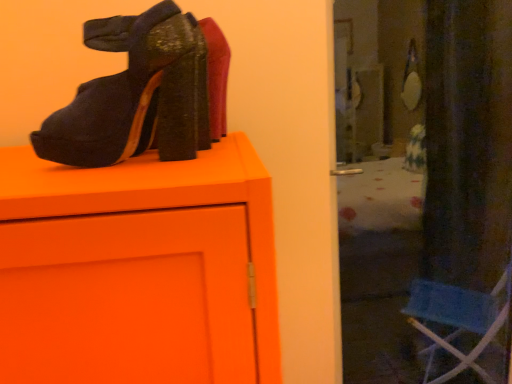
What are the coordinates of `shiny black leather high heels at upper left` in the screenshot? It's located at [133, 95].

This screenshot has width=512, height=384. Describe the element at coordinates (133, 95) in the screenshot. I see `shiny black leather high heels at upper left` at that location.

You are a GUI agent. You are given a task and a screenshot of the screen. Output one action in this format:
    pyautogui.click(x=<x>, y=<y>)
    Task: Click on the shiny black leather high heels at upper left
    
    Given the screenshot: What is the action you would take?
    pyautogui.click(x=133, y=95)